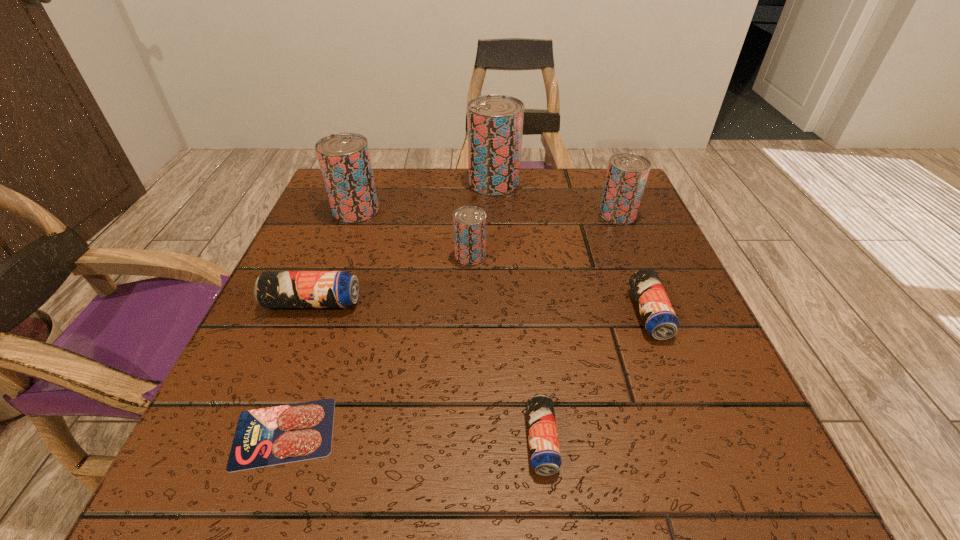
Select which red beer can appears as the closest to the tallest beer can. Please provide its 2D coordinates. Your answer should be formatted as a tuple, i.e. [(x, y)], where the tuple contains the x and y coordinates of a point satisfying the conditions above.

[(627, 173)]

Where is `blue beer can that stands as the closest to the third shortest beer can`? The image size is (960, 540). blue beer can that stands as the closest to the third shortest beer can is located at coordinates (545, 456).

The width and height of the screenshot is (960, 540). I want to click on blue beer can that is the closest to the nearest red beer can, so click(273, 289).

The height and width of the screenshot is (540, 960). Find the location of `vacant region that satisfies the following two spatial constraints: 1. on the back side of the fifth tallest beer can; 2. on the left side of the seventh shortest object`. vacant region that satisfies the following two spatial constraints: 1. on the back side of the fifth tallest beer can; 2. on the left side of the seventh shortest object is located at coordinates (349, 211).

Where is `vacant space that satisfies the following two spatial constraints: 1. on the back side of the leftmost blue beer can; 2. on the right side of the fourth tallest object`? Image resolution: width=960 pixels, height=540 pixels. vacant space that satisfies the following two spatial constraints: 1. on the back side of the leftmost blue beer can; 2. on the right side of the fourth tallest object is located at coordinates (331, 255).

Where is `vacant space that satisfies the following two spatial constraints: 1. on the back side of the fourth shortest object; 2. on the right side of the farthest beer can`? Image resolution: width=960 pixels, height=540 pixels. vacant space that satisfies the following two spatial constraints: 1. on the back side of the fourth shortest object; 2. on the right side of the farthest beer can is located at coordinates (360, 183).

Identify the location of vacant region that satisfies the following two spatial constraints: 1. on the back side of the second shortest beer can; 2. on the left side of the shortest object. (326, 313).